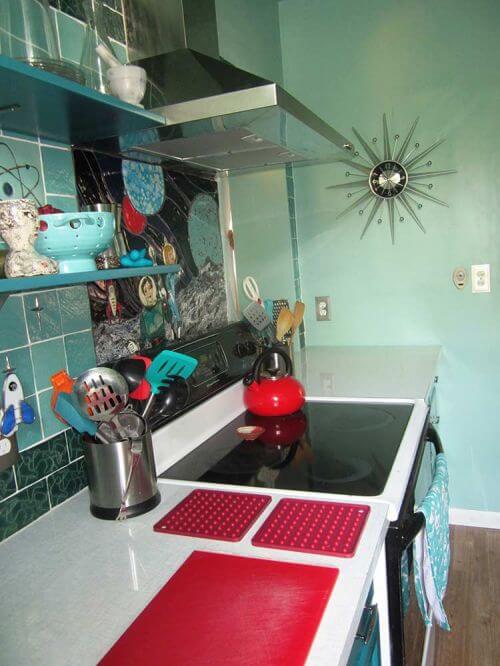
Identify the location of cloth. The height and width of the screenshot is (666, 500). (434, 585).